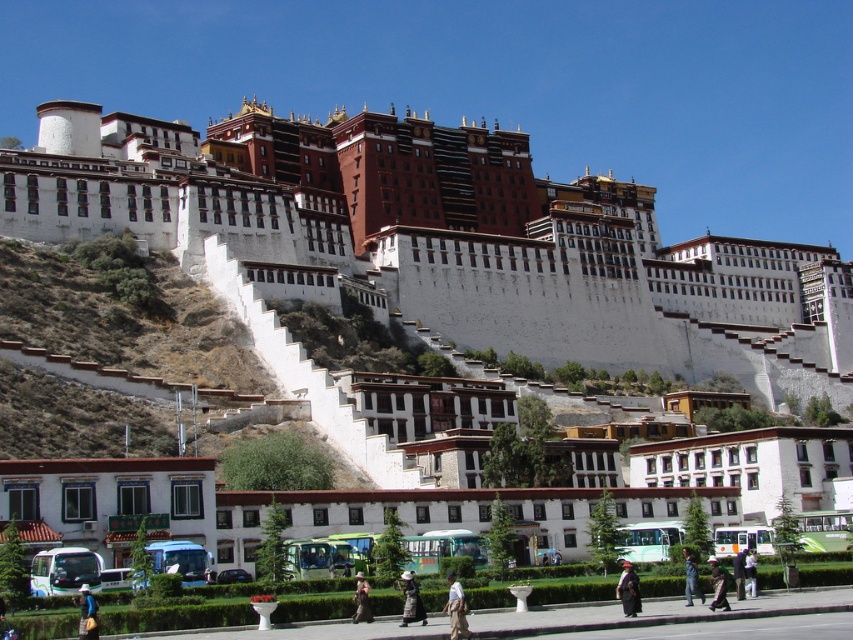
You are a photographer planning to take a photo of the dark brown leather jacket at center and the dark blue fabric coat at lower right. Which object should you focus on first if you want to capture both in a single frame without moving the camera?

You should focus on the dark brown leather jacket at center first because it occupies less space than the dark blue fabric coat at lower right, allowing you to frame both effectively by prioritizing the smaller object.

You are standing in front of the grand architectural complex and see the khaki cotton pants at lower center and the dark blue fabric coat at lower right. Which object is nearer to you?

The khaki cotton pants at lower center is closer to the viewer than the dark blue fabric coat at lower right.

You are a photographer trying to capture a photo of the khaki cotton pants at lower center and the dark blue fabric coat at lower right in the scene. Which object should you focus on first if you want to include both in your frame without moving the camera?

The khaki cotton pants at lower center is positioned on the left side of the dark blue fabric coat at lower right, so you should focus on the khaki cotton pants at lower center first to ensure both are in frame.